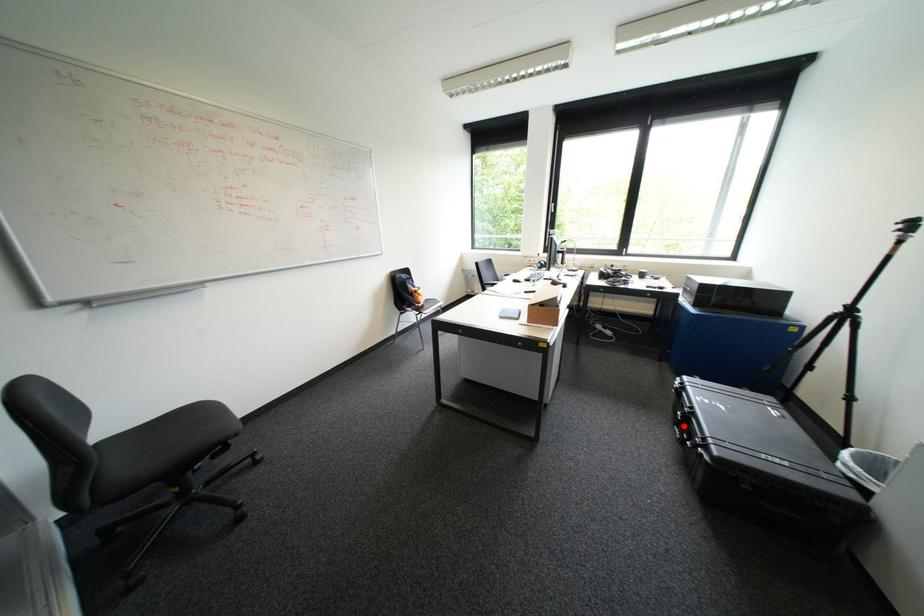
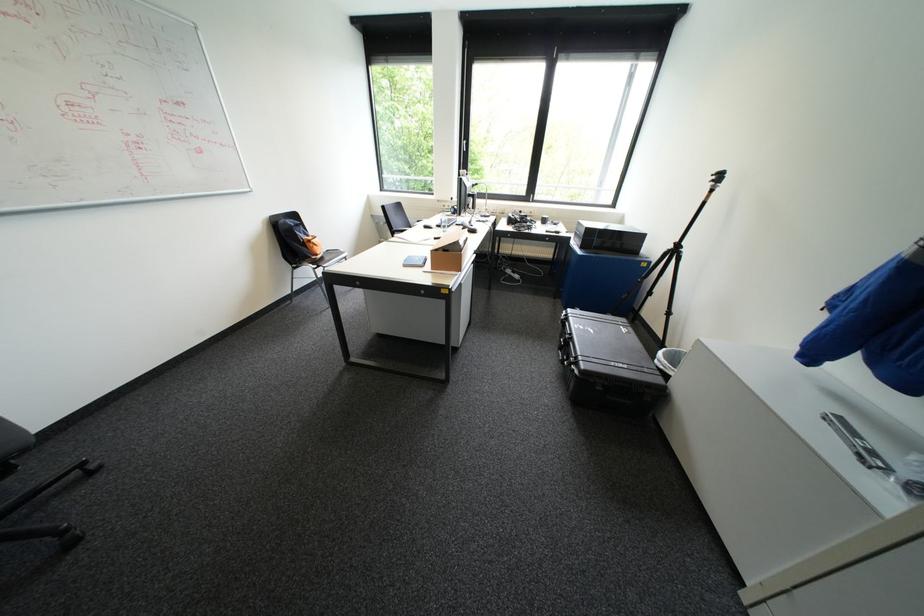
Where in the second image is the point corresponding to the highlighted location from the first image?

(567, 350)